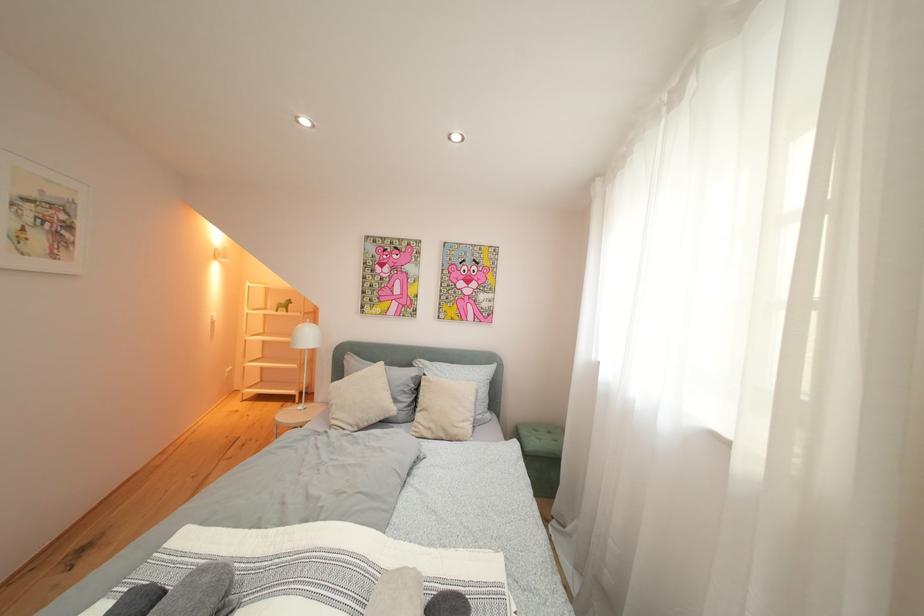
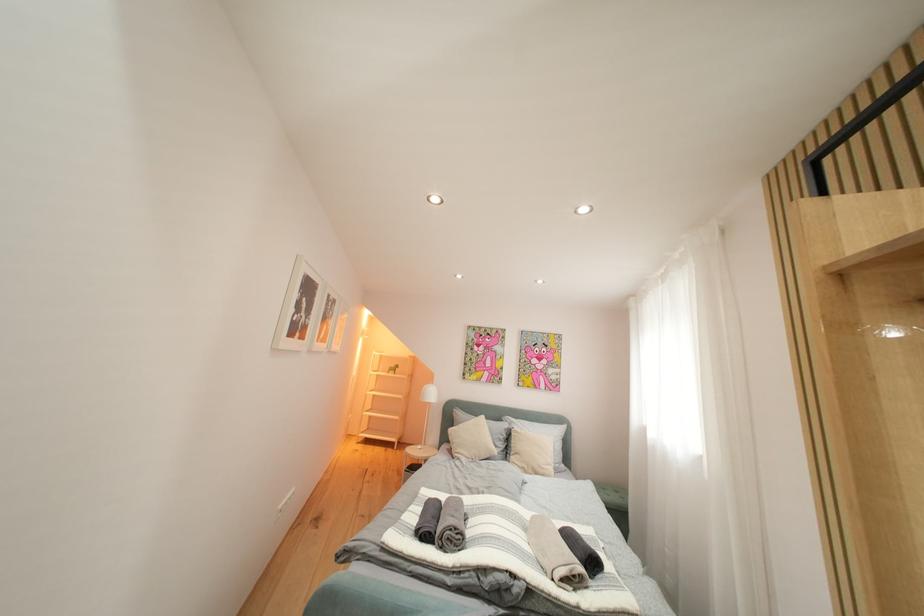
In a continuous first-person perspective shot, in which direction is the camera moving?

The movement direction of the cameraman is left, backward.